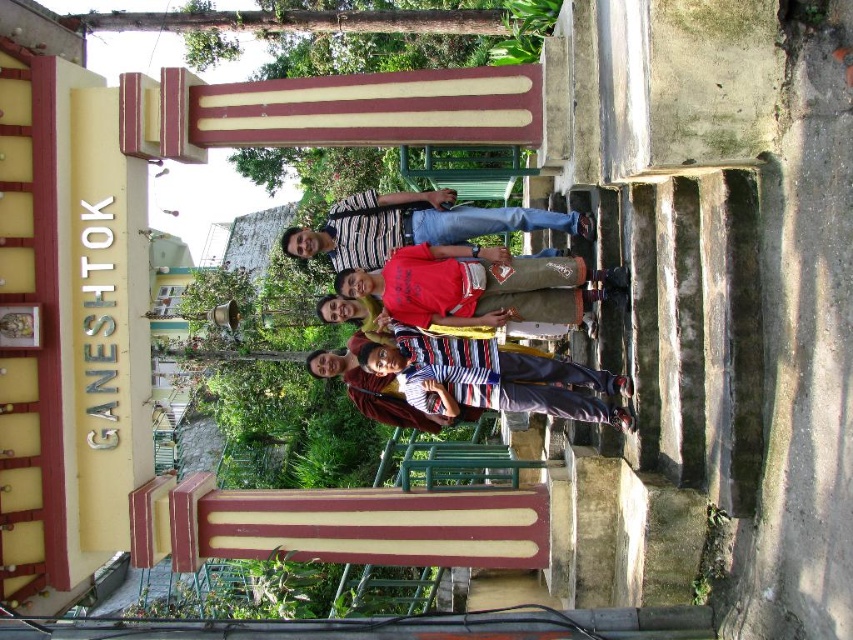
Question: Estimate the real-world distances between objects in this image. Which object is farther from the green metal ladder at center?

Choices:
 (A) striped fabric shirt at center
 (B) red cotton shirt at center
 (C) striped shirt at center

Answer: (C)

Question: Which is farther from the striped shirt at center?

Choices:
 (A) green metal ladder at center
 (B) red cotton shirt at center
 (C) striped fabric shirt at center

Answer: (A)

Question: Does striped shirt at center lie behind green metal ladder at center?

Choices:
 (A) yes
 (B) no

Answer: (B)

Question: Is red cotton shirt at center further to camera compared to green metal ladder at center?

Choices:
 (A) no
 (B) yes

Answer: (A)

Question: Can you confirm if striped fabric shirt at center is smaller than striped shirt at center?

Choices:
 (A) yes
 (B) no

Answer: (A)

Question: Which object is the closest to the green metal ladder at center?

Choices:
 (A) striped fabric shirt at center
 (B) red cotton shirt at center

Answer: (A)